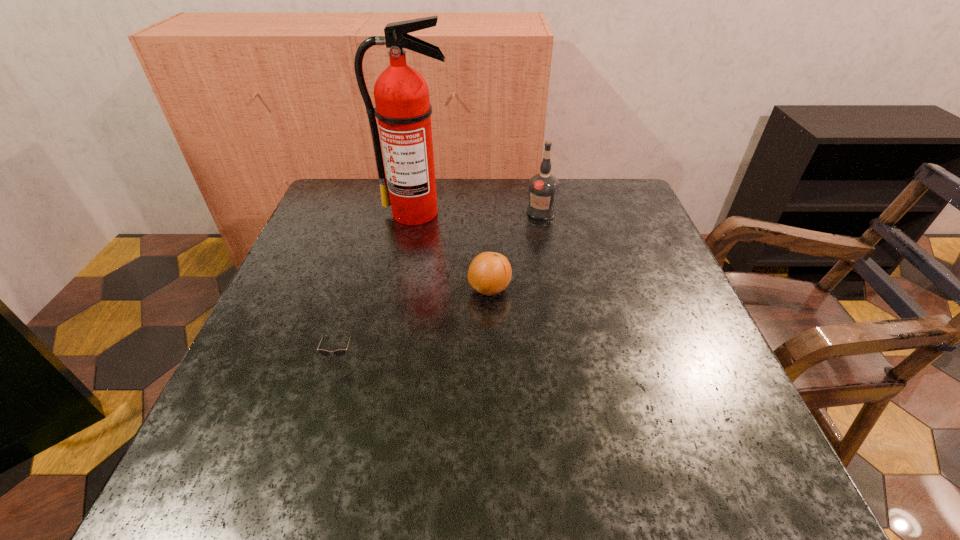
Identify the location of blank region between the fire extinguisher and the sunglasses. The image size is (960, 540). (378, 285).

Locate an element on the screen. The width and height of the screenshot is (960, 540). object that stands as the third closest to the second object from right to left is located at coordinates (543, 187).

Select which object appears as the closest to the vodka. Please provide its 2D coordinates. Your answer should be formatted as a tuple, i.e. [(x, y)], where the tuple contains the x and y coordinates of a point satisfying the conditions above.

[(403, 109)]

Find the location of a particular element. vacant region that satisfies the following two spatial constraints: 1. on the side of the fire extinguisher near the handle; 2. on the right side of the orange is located at coordinates (401, 289).